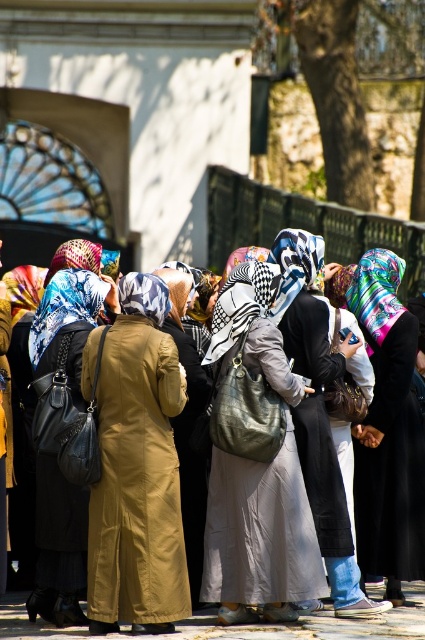
Is matte black dress at center to the left of printed silk headscarf at center from the viewer's perspective?

Incorrect, matte black dress at center is not on the left side of printed silk headscarf at center.

Does matte black dress at center come in front of printed silk headscarf at center?

Yes, matte black dress at center is in front of printed silk headscarf at center.

In the scene shown: Who is more distant from viewer, (308, 260) or (99, 310)?

Positioned behind is point (308, 260).

What are the coordinates of `matte black dress at center` in the screenshot? It's located at [317, 410].

Between multicolored patterned scarf at center and patterned silk headscarf at center, which one is positioned higher?

Positioned higher is patterned silk headscarf at center.

Does multicolored patterned scarf at center have a smaller size compared to patterned silk headscarf at center?

Indeed, multicolored patterned scarf at center has a smaller size compared to patterned silk headscarf at center.

Find the location of a particular element. This screenshot has width=425, height=640. multicolored patterned scarf at center is located at coordinates (387, 424).

Does point (360, 442) lie in front of point (65, 316)?

No, (360, 442) is further to viewer.

Is point (374, 333) farther from viewer compared to point (68, 509)?

Yes, point (374, 333) is farther from viewer.

What are the coordinates of `multicolored patterned scarf at center` in the screenshot? It's located at (387, 424).